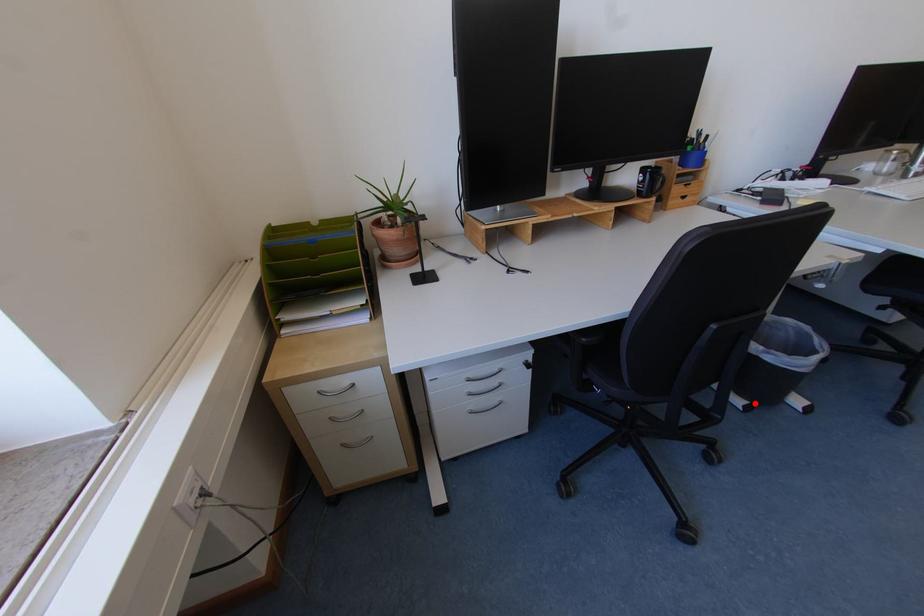
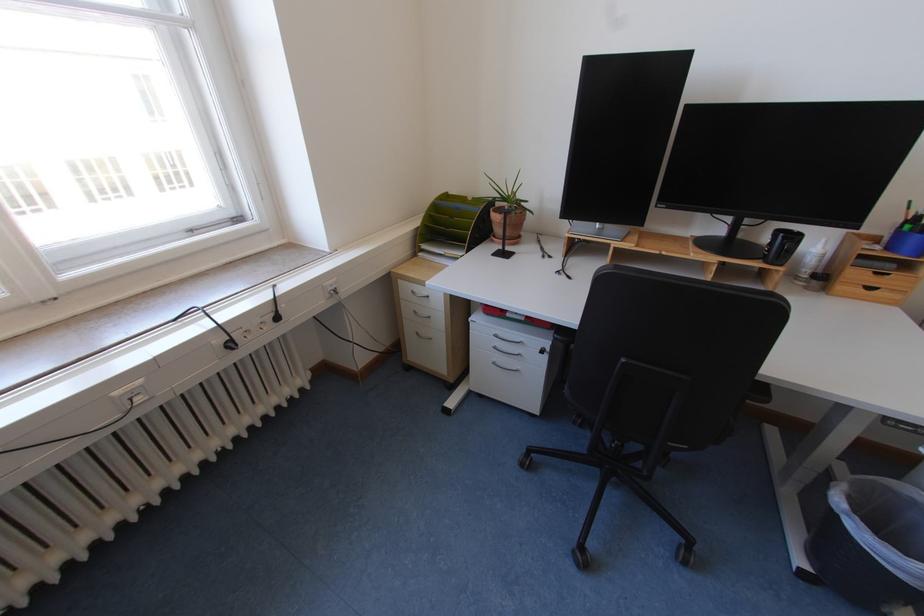
In the second image, find the point that corresponds to the highlighted location in the first image.

(819, 572)